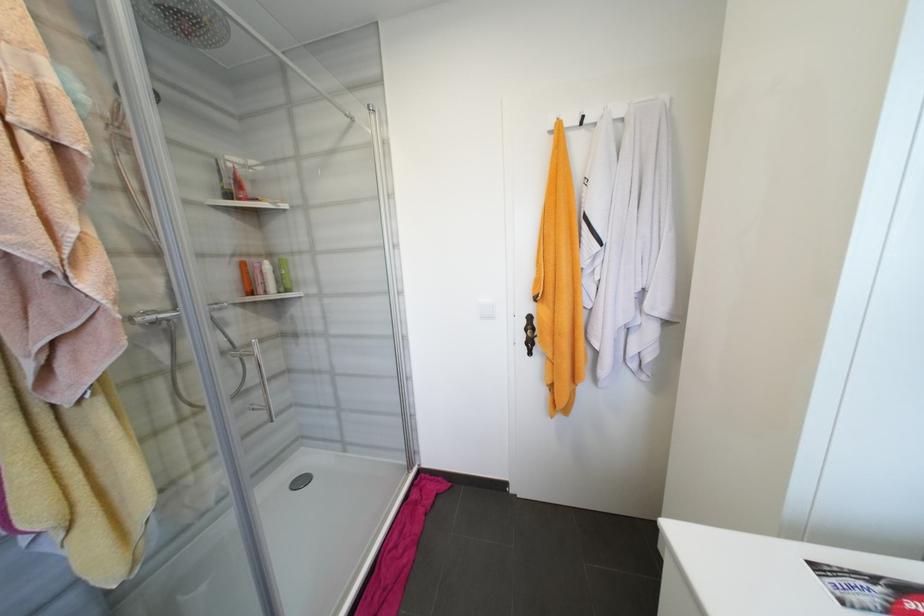
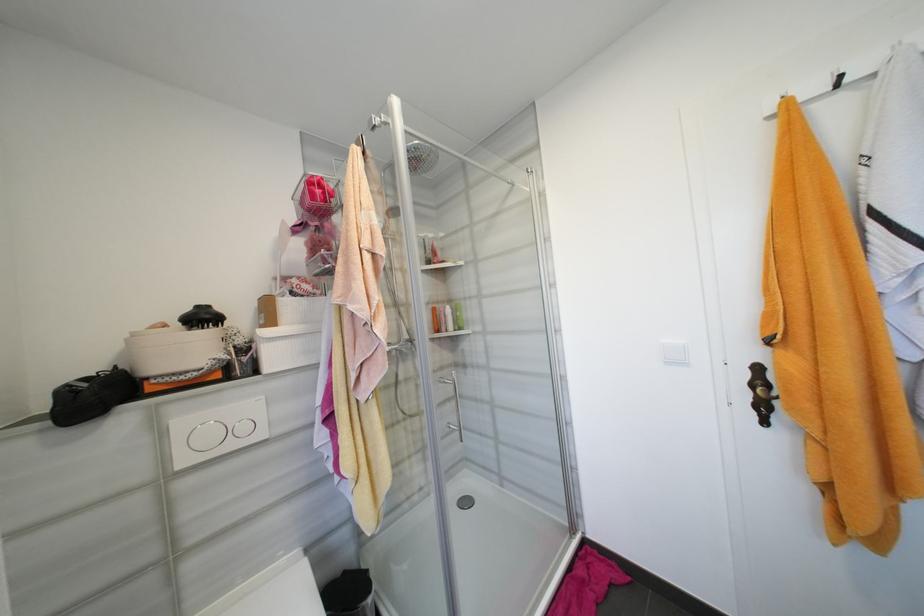
Question: The first image is from the beginning of the video and the second image is from the end. How did the camera likely rotate when shooting the video?

Choices:
 (A) Left
 (B) Right
 (C) Up
 (D) Down

Answer: (A)